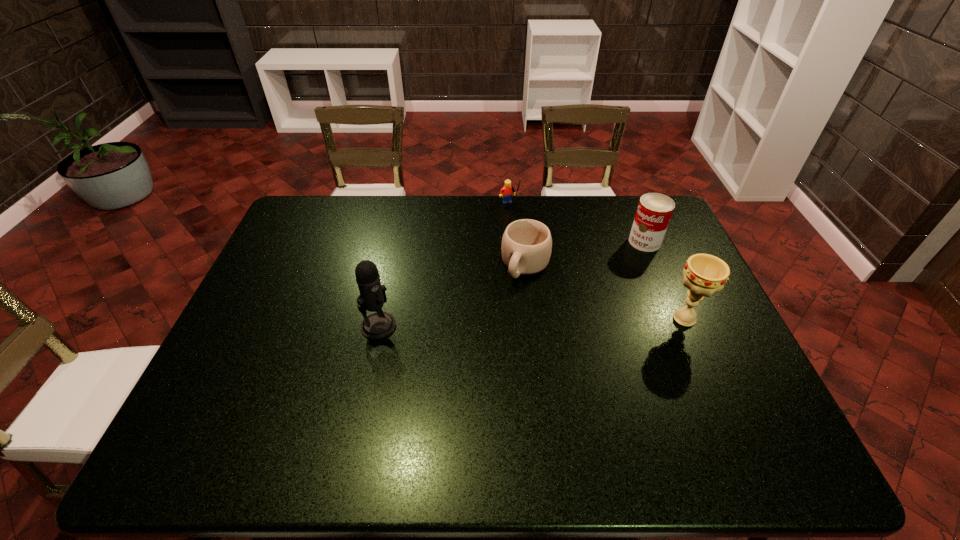
Where is `vacant space located on the front label of the third shortest object`? This screenshot has height=540, width=960. vacant space located on the front label of the third shortest object is located at coordinates point(615,258).

Where is `free location located 0.200m on the side of the mug with the handle`? free location located 0.200m on the side of the mug with the handle is located at coordinates (489, 332).

Identify the location of free spot located on the side of the mug with the handle. The width and height of the screenshot is (960, 540). (495, 321).

Image resolution: width=960 pixels, height=540 pixels. Find the location of `vacant region located on the side of the mug with the handle`. vacant region located on the side of the mug with the handle is located at coordinates (510, 295).

The image size is (960, 540). I want to click on vacant position located 0.110m on the front-facing side of the farthest object, so click(x=521, y=229).

Locate an element on the screen. The image size is (960, 540). vacant space located on the front-facing side of the farthest object is located at coordinates (529, 243).

Identify the location of vacant region located on the front-facing side of the farthest object. Image resolution: width=960 pixels, height=540 pixels. tap(541, 267).

The image size is (960, 540). What are the coordinates of `can that is positioned at the far edge` in the screenshot? It's located at (654, 211).

Find the location of `Lego positioned at the far edge`. Lego positioned at the far edge is located at coordinates (506, 192).

Identify the location of chalice that is at the right edge. This screenshot has width=960, height=540. (704, 274).